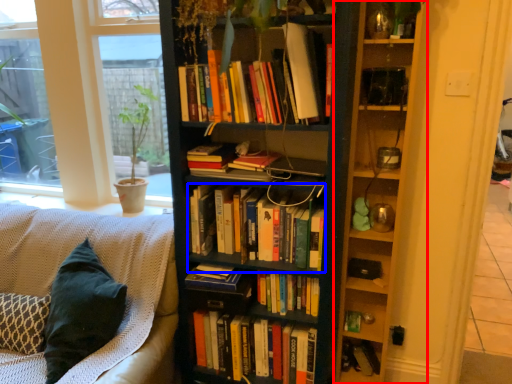
Question: Among these objects, which one is farthest to the camera, shelf (highlighted by a red box) or book (highlighted by a blue box)?

Choices:
 (A) shelf
 (B) book

Answer: (B)